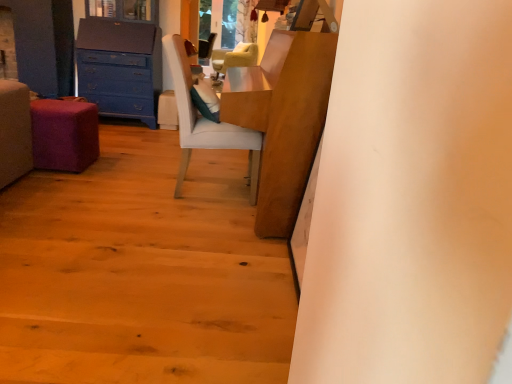
Image resolution: width=512 pixels, height=384 pixels. In order to click on free space to the left of wooden table at center in this screenshot , I will do `click(114, 182)`.